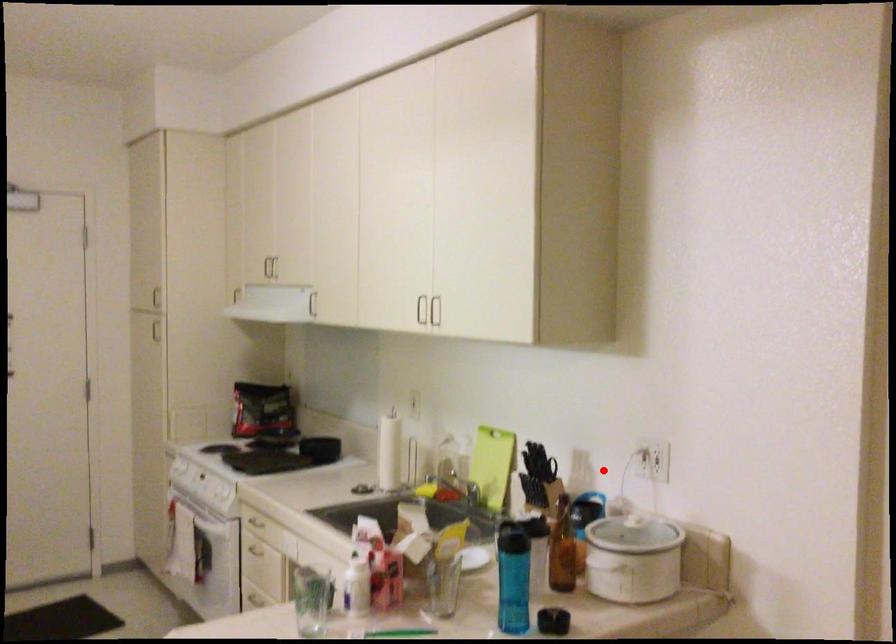
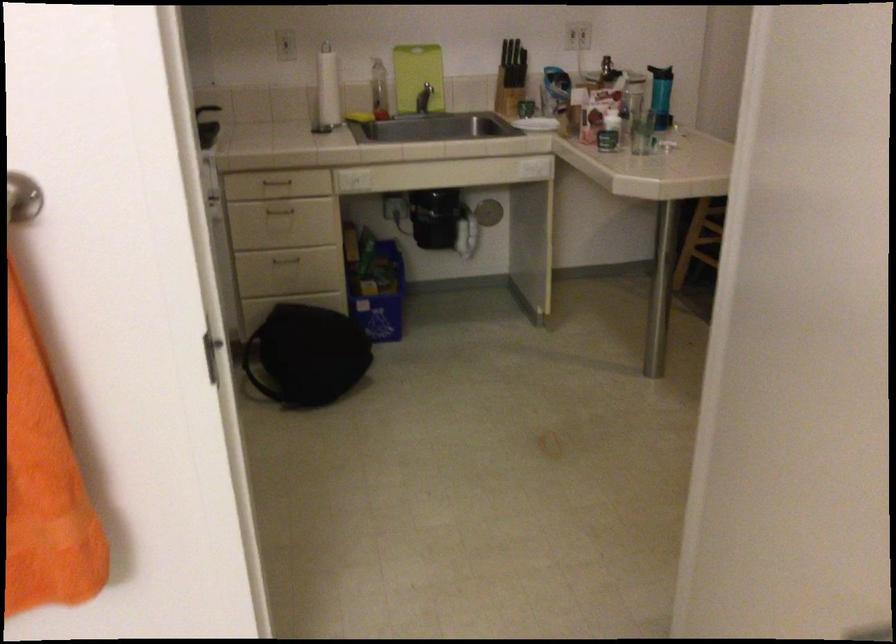
Question: I am providing you with two images of the same scene from different viewpoints. Image1 has a red point marked. In image2, the corresponding 3D location appears at what relative position? Reply with the corresponding letter.

Choices:
 (A) Closer
 (B) Farther

Answer: (B)